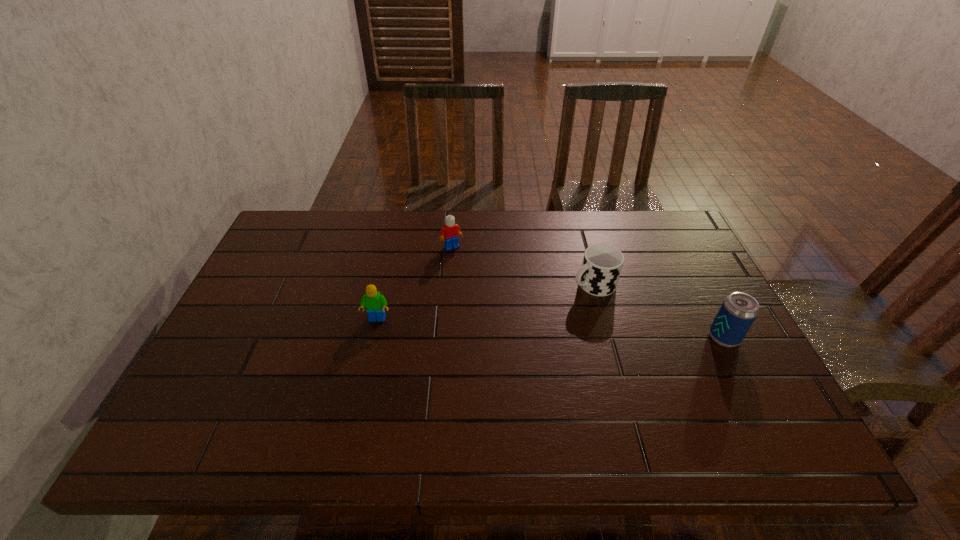
The width and height of the screenshot is (960, 540). In order to click on vacant space on the desktop that is between the second nearest object and the nearest object and is positioned on the face of the right Lego in this screenshot , I will do pyautogui.click(x=504, y=326).

Identify the location of free space on the desktop that is between the left Lego and the rightmost object and is positioned on the side of the third object from left to right with the handle. The height and width of the screenshot is (540, 960). (x=505, y=326).